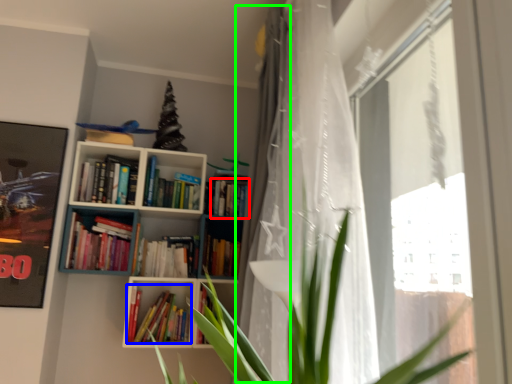
Question: Which object is the farthest from book (highlighted by a red box)? Choose among these: book (highlighted by a blue box) or curtain (highlighted by a green box).

Choices:
 (A) book
 (B) curtain

Answer: (B)